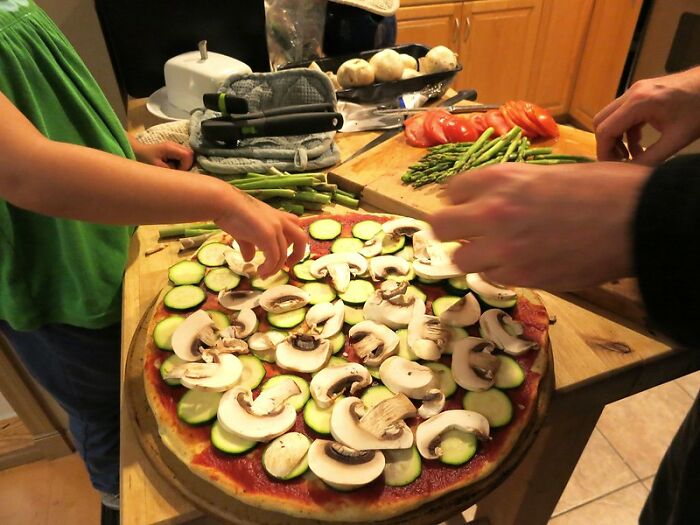
Where is `wooden table and leg`? The height and width of the screenshot is (525, 700). wooden table and leg is located at coordinates tap(582, 340), tap(540, 466).